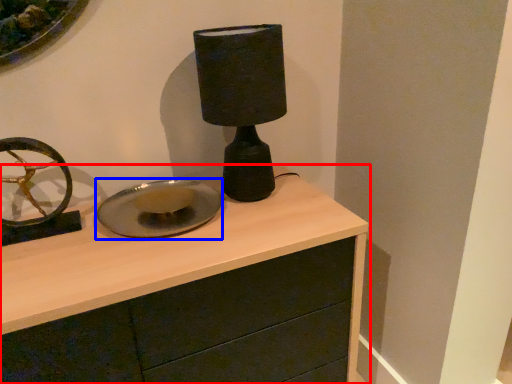
Question: Which point is closer to the camera, chest of drawers (highlighted by a red box) or plate (highlighted by a blue box)?

Choices:
 (A) chest of drawers
 (B) plate

Answer: (A)